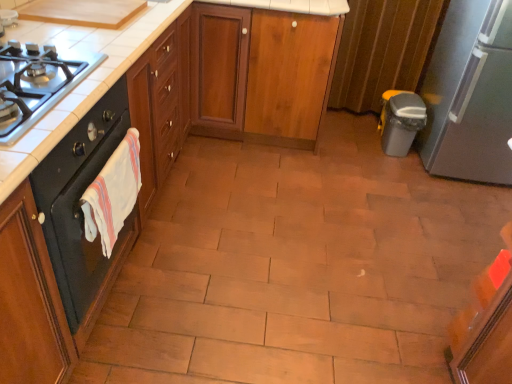
Question: In terms of width, does wooden cabinet at center, which is counted as the second cabinetry, starting from the front, look wider or thinner when compared to black matte oven at left?

Choices:
 (A) wide
 (B) thin

Answer: (A)

Question: From the image's perspective, relative to black matte oven at left, is wooden cabinet at center, the 1th cabinetry when ordered from back to front, above or below?

Choices:
 (A) below
 (B) above

Answer: (B)

Question: Based on their relative distances, which object is farther from the black matte oven at left?

Choices:
 (A) wooden cabinet at center, the 1th cabinetry when ordered from back to front
 (B) satin silver refrigerator at right
 (C) black matte gas stove at left
 (D) white cotton hand towel at left
 (E) wooden cabinet at center, placed as the first cabinetry when sorted from front to back

Answer: (B)

Question: Which object is the closest to the wooden cabinet at center, the 1th cabinetry when ordered from back to front?

Choices:
 (A) black matte gas stove at left
 (B) satin silver refrigerator at right
 (C) white cotton hand towel at left
 (D) black matte oven at left
 (E) wooden cabinet at center, placed as the first cabinetry when sorted from front to back

Answer: (E)